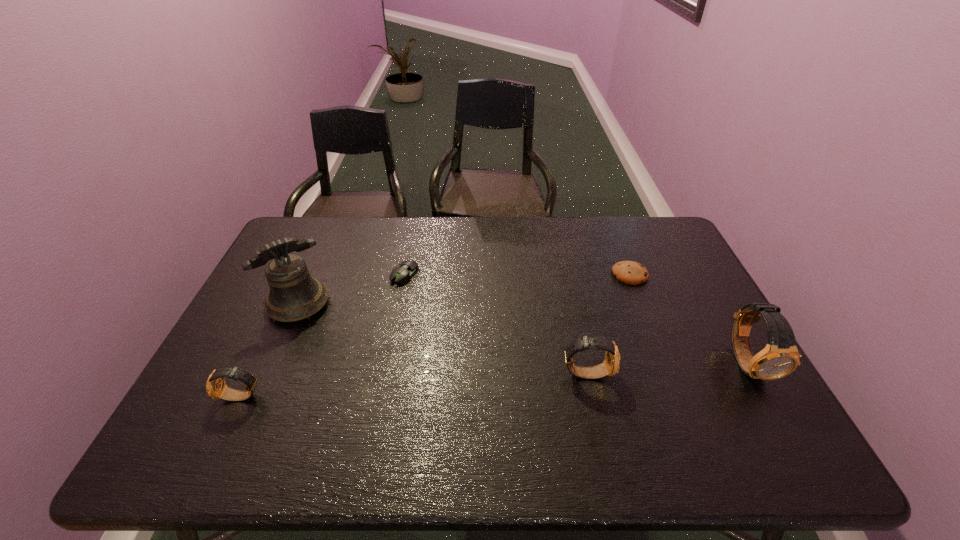
The image size is (960, 540). What are the coordinates of `free area in between the bell and the fourth shortest object` in the screenshot? It's located at (443, 339).

The height and width of the screenshot is (540, 960). Identify the location of vacant area between the tallest object and the third object from right to left. (443, 339).

Locate which object is the third closest to the cookie. Please provide its 2D coordinates. Your answer should be formatted as a tuple, i.e. [(x, y)], where the tuple contains the x and y coordinates of a point satisfying the conditions above.

[(401, 274)]

Locate an element on the screen. Image resolution: width=960 pixels, height=540 pixels. the fourth closest object to the tallest object is located at coordinates (629, 272).

Identify which watch is the third closest to the bell. Please provide its 2D coordinates. Your answer should be formatted as a tuple, i.e. [(x, y)], where the tuple contains the x and y coordinates of a point satisfying the conditions above.

[(780, 357)]

Locate which watch is the second closest to the fifth object from left to right. Please provide its 2D coordinates. Your answer should be formatted as a tuple, i.e. [(x, y)], where the tuple contains the x and y coordinates of a point satisfying the conditions above.

[(611, 365)]

Find the location of a particular element. The width and height of the screenshot is (960, 540). blank area in the image that satisfies the following two spatial constraints: 1. on the face of the second tallest object; 2. on the face of the leftmost watch is located at coordinates (767, 397).

Identify the location of free spot that satisfies the following two spatial constraints: 1. on the face of the rightmost object; 2. on the face of the shortest watch. Image resolution: width=960 pixels, height=540 pixels. (767, 397).

Identify the location of vacant space that satisfies the following two spatial constraints: 1. on the front side of the fifth object from left to right; 2. on the face of the second shortest watch. (668, 373).